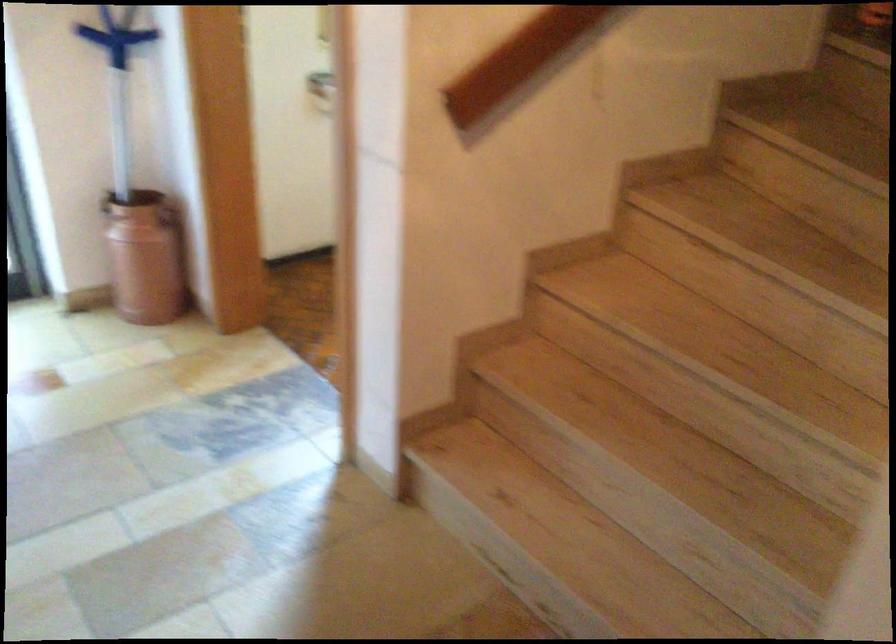
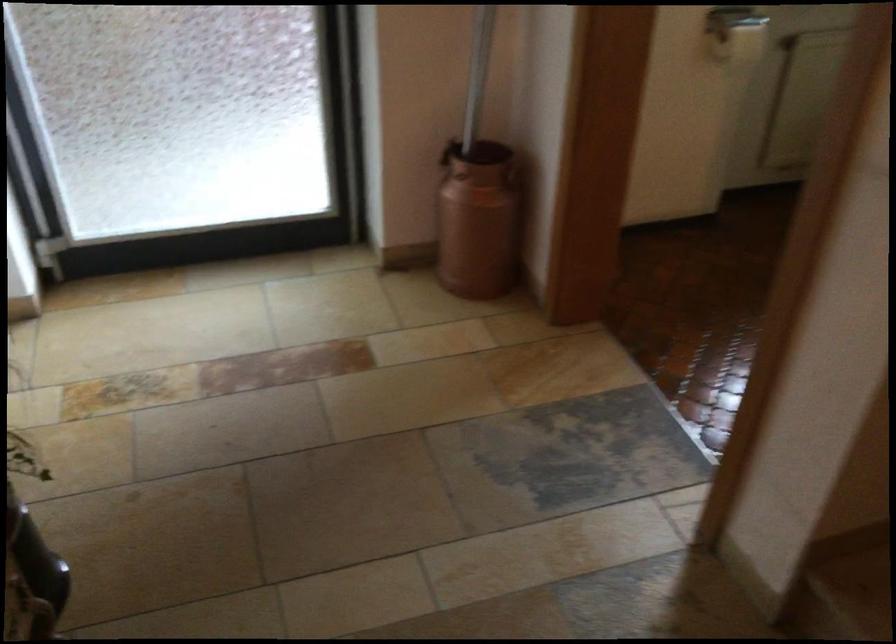
The point at (144, 254) is marked in the first image. Where is the corresponding point in the second image?

(478, 220)